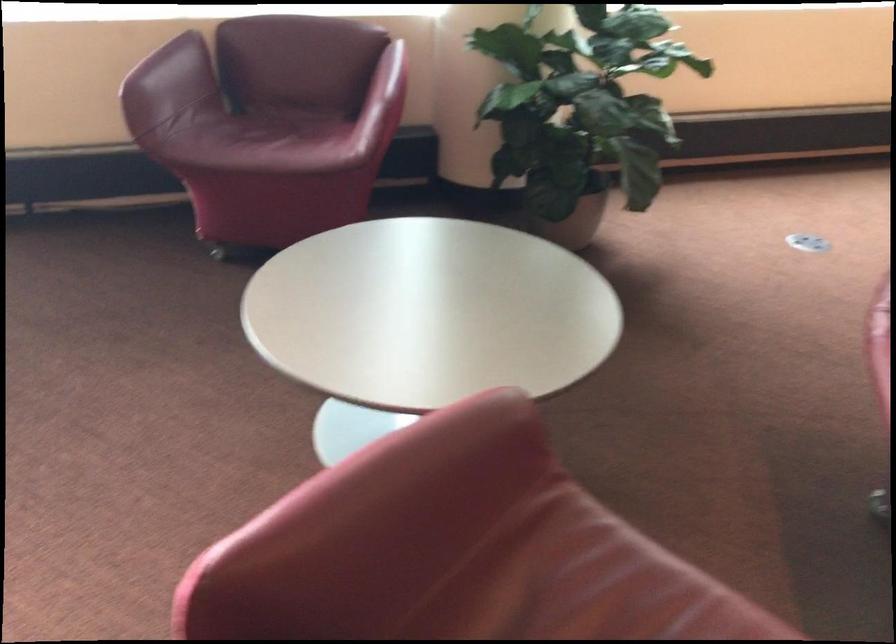
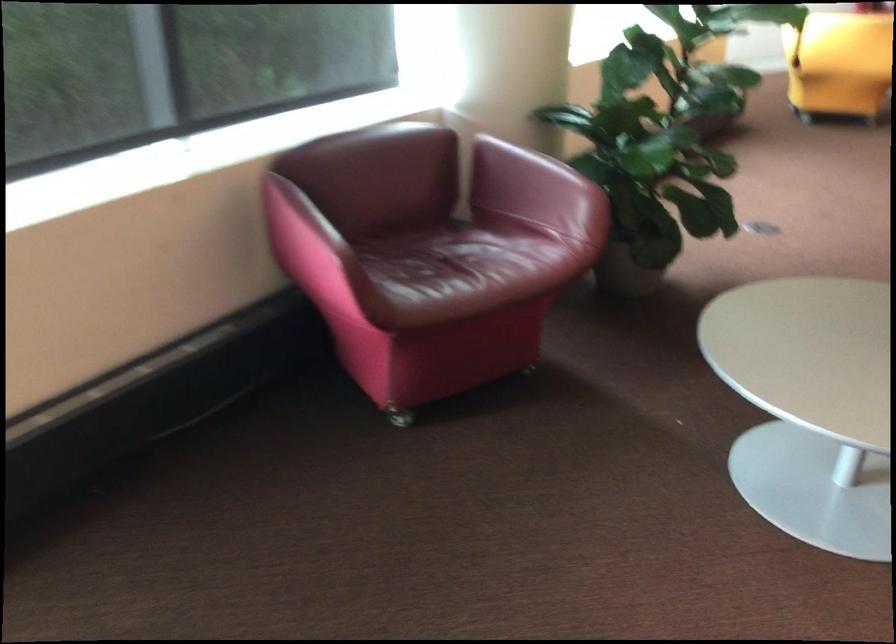
Question: I am providing you with two images of the same scene from different viewpoints. Which of the following objects are not visible in image2?

Choices:
 (A) black hanger clip
 (B) chair caster wheel
 (C) pink chair armrest
 (D) plant pot

Answer: (D)